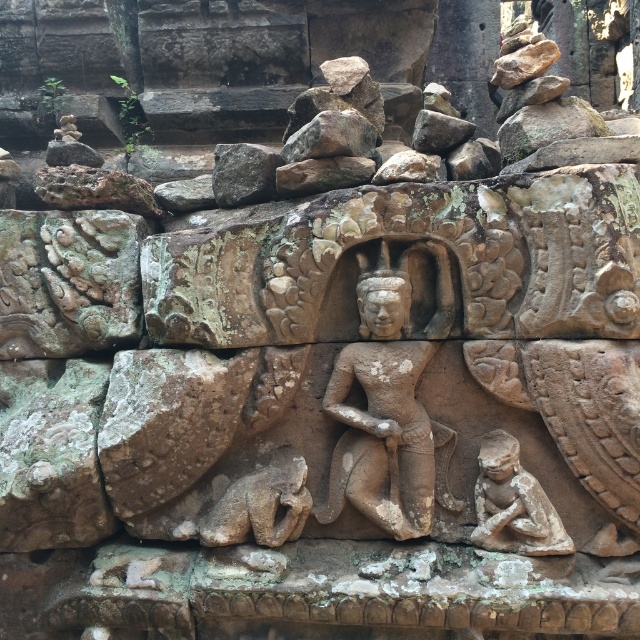
Question: In this image, where is brown stone cat at lower center located relative to rusty stone at upper center?

Choices:
 (A) left
 (B) right

Answer: (A)

Question: Which point is closer to the camera?

Choices:
 (A) stone figure at lower right
 (B) stone statue at center

Answer: (A)

Question: Estimate the real-world distances between objects in this image. Which object is closer to the rusty stone at upper center?

Choices:
 (A) stone statue at center
 (B) brown stone cat at lower center

Answer: (A)

Question: Which object is the farthest from the stone statue at center?

Choices:
 (A) rusty stone at upper center
 (B) brown stone cat at lower center
 (C) stone figure at lower right

Answer: (A)

Question: Does stone statue at center appear under stone figure at lower right?

Choices:
 (A) yes
 (B) no

Answer: (B)

Question: Is stone statue at center further to camera compared to rusty stone at upper center?

Choices:
 (A) yes
 (B) no

Answer: (B)